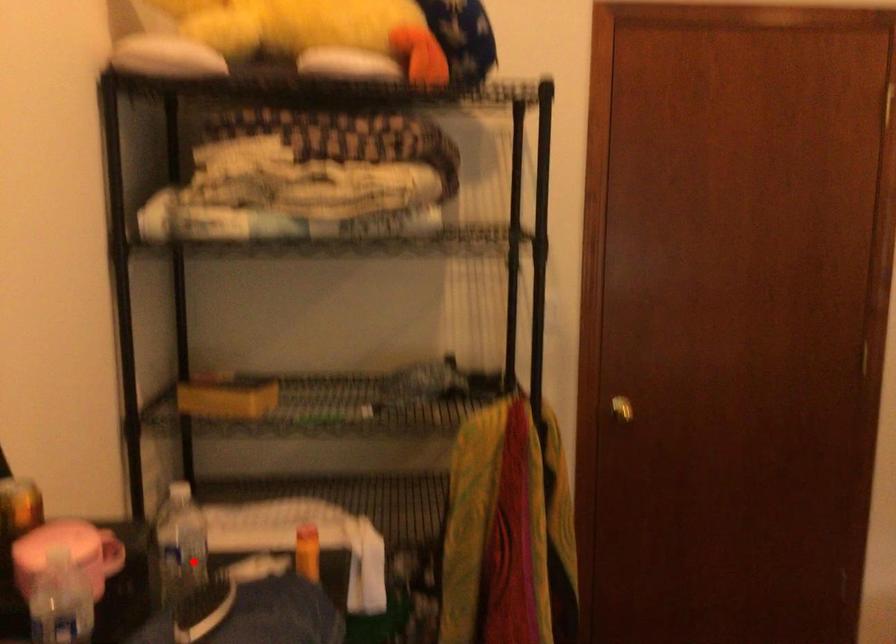
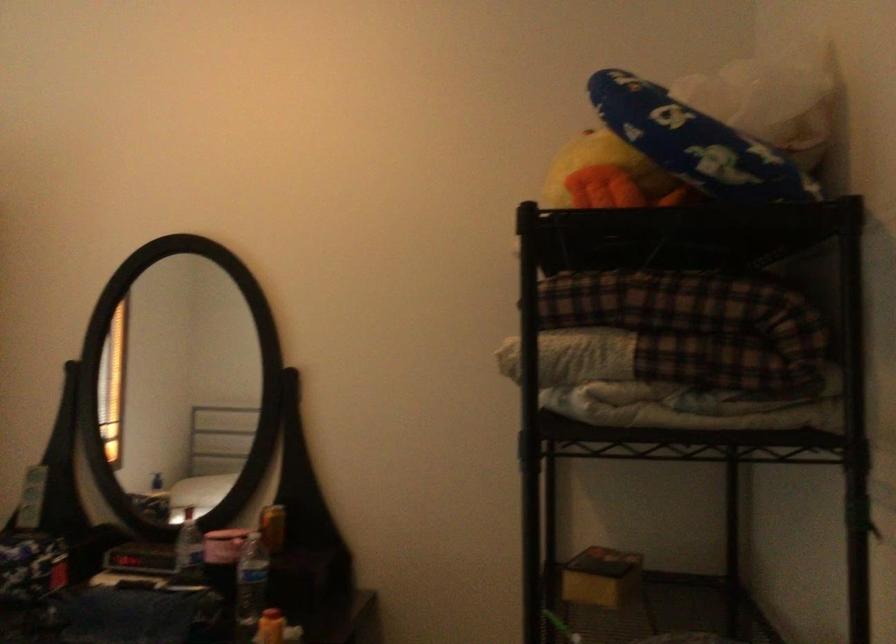
Question: A red point is marked in image1. In image2, is the corresponding 3D point closer to the camera or farther? Reply with the corresponding letter.

Choices:
 (A) The corresponding 3D point is closer.
 (B) The corresponding 3D point is farther.

Answer: (B)